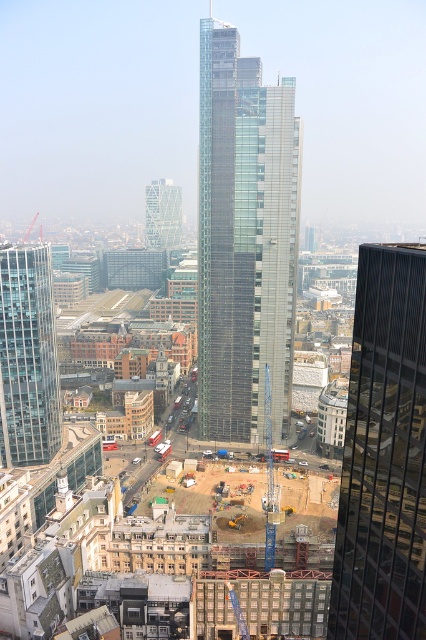
You are an architect reviewing a city blueprint. You notice two structures labeled as the transparent glass skyscraper at center and the translucent glass tower at center. According to the blueprint, which one is positioned to the right of the other?

The transparent glass skyscraper at center is positioned to the right of the translucent glass tower at center according to the blueprint.

You are a city planner reviewing this urban layout. You notice a point at coordinates (28,356). Based on the scene description, which structure does this point most likely belong to?

The point at coordinates (28,356) corresponds to the transparent glass skyscraper at left.